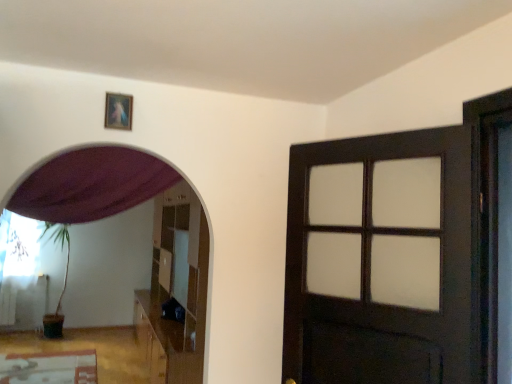
Question: Should I look upward or downward to see glossy wooden dresser at center?

Choices:
 (A) up
 (B) down

Answer: (B)

Question: Are purple fabric curtain at upper left, which ranks as the 1th curtain in right-to-left order, and glossy wooden dresser at center beside each other?

Choices:
 (A) no
 (B) yes

Answer: (A)

Question: From the image's perspective, does purple fabric curtain at upper left, which is counted as the 2th curtain, starting from the left, appear higher than glossy wooden dresser at center?

Choices:
 (A) yes
 (B) no

Answer: (A)

Question: Does purple fabric curtain at upper left, which appears as the 2th curtain when ordered from the bottom, come behind glossy wooden dresser at center?

Choices:
 (A) yes
 (B) no

Answer: (B)

Question: Is purple fabric curtain at upper left, which appears as the 2th curtain when ordered from the bottom, oriented away from glossy wooden dresser at center?

Choices:
 (A) yes
 (B) no

Answer: (B)

Question: Is glossy wooden dresser at center a part of purple fabric curtain at upper left, which ranks as the 1th curtain in right-to-left order?

Choices:
 (A) no
 (B) yes

Answer: (A)

Question: Can you confirm if purple fabric curtain at upper left, which is counted as the 2th curtain, starting from the left, is smaller than glossy wooden dresser at center?

Choices:
 (A) no
 (B) yes

Answer: (B)

Question: Can we say purple fabric curtain at upper left, which is the 2th curtain from back to front, lies outside dark wood door at right?

Choices:
 (A) yes
 (B) no

Answer: (A)

Question: Does purple fabric curtain at upper left, which ranks as the 1th curtain in right-to-left order, appear on the right side of dark wood door at right?

Choices:
 (A) no
 (B) yes

Answer: (A)

Question: Considering the relative positions of purple fabric curtain at upper left, which is the 2th curtain from back to front, and dark wood door at right in the image provided, is purple fabric curtain at upper left, which is the 2th curtain from back to front, behind dark wood door at right?

Choices:
 (A) yes
 (B) no

Answer: (A)

Question: Is purple fabric curtain at upper left, which appears as the 2th curtain when ordered from the bottom, positioned with its back to dark wood door at right?

Choices:
 (A) no
 (B) yes

Answer: (A)

Question: Could you tell me if purple fabric curtain at upper left, which is the first curtain in front-to-back order, is facing dark wood door at right?

Choices:
 (A) yes
 (B) no

Answer: (B)

Question: From a real-world perspective, is purple fabric curtain at upper left, which is the first curtain in front-to-back order, below dark wood door at right?

Choices:
 (A) yes
 (B) no

Answer: (B)

Question: Is dark wood door at right not inside white sheer curtain at left, marked as the second curtain in a front-to-back arrangement?

Choices:
 (A) no
 (B) yes

Answer: (B)